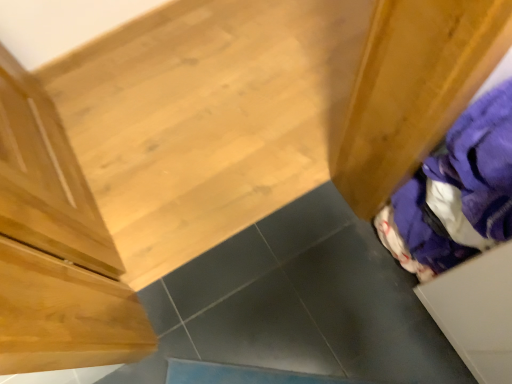
Question: Is purple fabric at right wider or thinner than white matte drawer at lower right?

Choices:
 (A) wide
 (B) thin

Answer: (B)

Question: Is purple fabric at right taller or shorter than white matte drawer at lower right?

Choices:
 (A) short
 (B) tall

Answer: (B)

Question: Is point (502, 129) positioned closer to the camera than point (483, 289)?

Choices:
 (A) farther
 (B) closer

Answer: (B)

Question: In terms of width, does white matte drawer at lower right look wider or thinner when compared to purple fabric at right?

Choices:
 (A) thin
 (B) wide

Answer: (B)

Question: Is white matte drawer at lower right spatially inside purple fabric at right, or outside of it?

Choices:
 (A) outside
 (B) inside

Answer: (A)

Question: Does point (500, 317) appear closer or farther from the camera than point (440, 254)?

Choices:
 (A) farther
 (B) closer

Answer: (B)

Question: In terms of size, does white matte drawer at lower right appear bigger or smaller than purple fabric at right?

Choices:
 (A) small
 (B) big

Answer: (B)